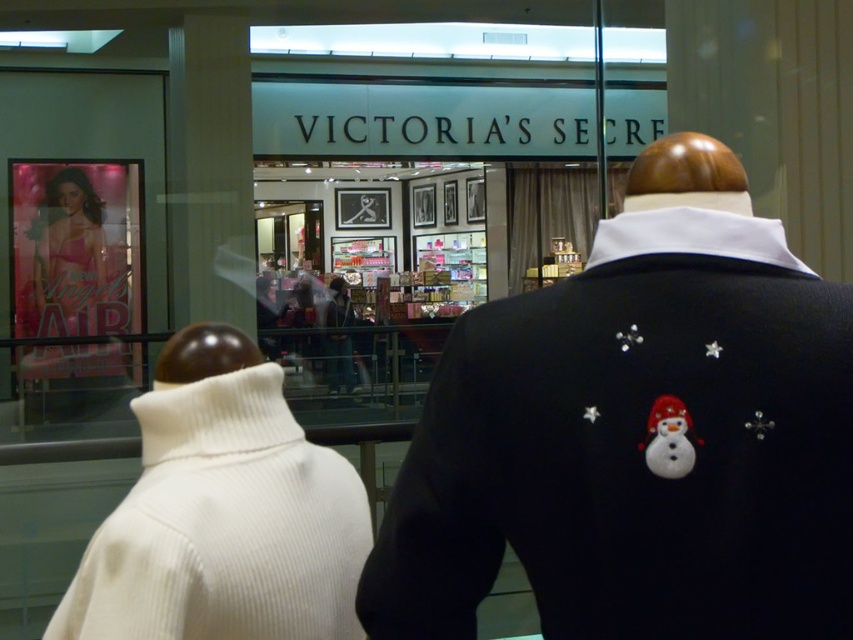
Based on the photo, you are a delivery person who needs to place a new package on the shelf behind the white ribbed sweater at left and the white glossy snowman at center. Based on their positions, which object should you move first to access the shelf?

The white glossy snowman at center is behind the white ribbed sweater at left, so you should move the white ribbed sweater at left first to access the shelf.

You are a delivery person trying to place a new snowman decoration between the white ribbed sweater at left and the white glossy snowman at center. Can the snowman fit between them without overlapping either?

The white ribbed sweater at left is wider than the white glossy snowman at center. Since the question is about fitting a new snowman between them, the existing space between the two objects depends on their widths and positions. However, the description only provides information about their widths, not the distance between them. Without knowing the exact spacing, it is impossible to determine if the new snowman will fit without overlapping.

You are a customer standing outside the Victoria Secret store looking through the window. You see the black wool sweater at right and the white glossy snowman at center. Which object is taller?

The black wool sweater at right is taller than the white glossy snowman at center.